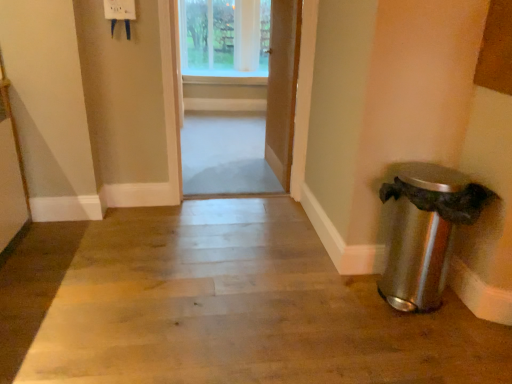
Describe the element at coordinates (244, 118) in the screenshot. Image resolution: width=512 pixels, height=384 pixels. I see `wooden door at center, the first door when ordered from left to right` at that location.

Identify the location of clear glass window at upper center. Image resolution: width=512 pixels, height=384 pixels. (224, 37).

Based on the photo, which is nearer, (403, 247) or (103, 220)?

The point (403, 247) is more forward.

In the image, is satin silver trash can at lower right positioned in front of or behind wooden floor at center?

Clearly, satin silver trash can at lower right is behind wooden floor at center.

Can you confirm if satin silver trash can at lower right is positioned to the left of wooden floor at center?

No, satin silver trash can at lower right is not to the left of wooden floor at center.

Considering the sizes of objects satin silver trash can at lower right and wooden floor at center in the image provided, who is taller, satin silver trash can at lower right or wooden floor at center?

Standing taller between the two is satin silver trash can at lower right.

Identify the location of window above the wooden door at center, the first door when ordered from left to right (from the image's perspective). (224, 37).

Between point (199, 164) and point (218, 9), which one is positioned in front?

The point (199, 164) is in front.

From a real-world perspective, is wooden door at center, which ranks as the 2th door in right-to-left order, above or below clear glass window at upper center?

From a real-world perspective, wooden door at center, which ranks as the 2th door in right-to-left order, is physically below clear glass window at upper center.

Is wooden door at center, which is the first door from right to left, inside the boundaries of wooden door at center, the first door when ordered from left to right, or outside?

wooden door at center, which is the first door from right to left, is not inside wooden door at center, the first door when ordered from left to right, it's outside.

From a real-world perspective, is wooden door at center, which is the first door from right to left, located beneath wooden door at center, the first door when ordered from left to right?

No, from a real-world perspective, wooden door at center, which is the first door from right to left, is not under wooden door at center, the first door when ordered from left to right.

Which of these two, wooden door at center, which is the first door from right to left, or wooden door at center, the first door when ordered from left to right, is bigger?

With larger size is wooden door at center, the first door when ordered from left to right.

Locate an element on the screen. Image resolution: width=512 pixels, height=384 pixels. waste container below the clear glass window at upper center (from the image's perspective) is located at coordinates (426, 231).

Does clear glass window at upper center turn towards satin silver trash can at lower right?

Yes.

How many degrees apart are the facing directions of clear glass window at upper center and satin silver trash can at lower right?

The angular difference between clear glass window at upper center and satin silver trash can at lower right is 4.98 degrees.

Does clear glass window at upper center appear on the left side of satin silver trash can at lower right?

Yes, clear glass window at upper center is to the left of satin silver trash can at lower right.

Can you tell me how much wooden door at center, which is the first door from right to left, and wooden floor at center differ in facing direction?

wooden door at center, which is the first door from right to left, and wooden floor at center are facing 94.8 degrees away from each other.

Considering the sizes of wooden door at center, the 2th door viewed from the left, and wooden floor at center in the image, is wooden door at center, the 2th door viewed from the left, wider or thinner than wooden floor at center?

wooden door at center, the 2th door viewed from the left, is thinner than wooden floor at center.

At what (x,y) coordinates should I click in order to perform the action: click on the 2nd door behind the wooden floor at center. Please return your answer as a coordinate pair (x, y). The width and height of the screenshot is (512, 384). Looking at the image, I should click on coord(282,86).

In the scene shown: From the image's perspective, which is below, wooden door at center, the 2th door viewed from the left, or wooden floor at center?

From the image's view, wooden floor at center is below.

Considering the sizes of clear glass window at upper center and wooden floor at center in the image, is clear glass window at upper center wider or thinner than wooden floor at center?

In the image, clear glass window at upper center appears to be more narrow than wooden floor at center.

Can you confirm if clear glass window at upper center is bigger than wooden floor at center?

No.

Who is taller, clear glass window at upper center or wooden floor at center?

Standing taller between the two is clear glass window at upper center.

Is wooden floor at center facing away from satin silver trash can at lower right?

No, wooden floor at center is not facing away from satin silver trash can at lower right.

In the image, is wooden floor at center positioned in front of or behind satin silver trash can at lower right?

wooden floor at center is in front of satin silver trash can at lower right.

Can you confirm if wooden floor at center is thinner than satin silver trash can at lower right?

No.

The width and height of the screenshot is (512, 384). What are the coordinates of `path below the satin silver trash can at lower right (from a real-world perspective)` in the screenshot? It's located at (220, 306).

Where is `the 1st door to the right when counting from the clear glass window at upper center`? The image size is (512, 384). the 1st door to the right when counting from the clear glass window at upper center is located at coordinates (244, 118).

Which object lies nearer to the anchor point satin silver trash can at lower right, clear glass window at upper center or wooden door at center, the first door when ordered from left to right?

wooden door at center, the first door when ordered from left to right, is closer to satin silver trash can at lower right.

From the image, which object appears to be nearer to wooden door at center, the 2th door viewed from the left, wooden door at center, which ranks as the 2th door in right-to-left order, or clear glass window at upper center?

wooden door at center, which ranks as the 2th door in right-to-left order.

Looking at the image, which one is located further to wooden door at center, the 2th door viewed from the left, wooden floor at center or clear glass window at upper center?

clear glass window at upper center.

Considering their positions, is clear glass window at upper center positioned closer to wooden door at center, the 2th door viewed from the left, than wooden floor at center?

The object closer to wooden door at center, the 2th door viewed from the left, is wooden floor at center.

When comparing their distances from wooden floor at center, does clear glass window at upper center or wooden door at center, the 2th door viewed from the left, seem further?

Among the two, clear glass window at upper center is located further to wooden floor at center.

When comparing their distances from wooden door at center, the first door when ordered from left to right, does wooden floor at center or wooden door at center, which is the first door from right to left, seem closer?

Based on the image, wooden door at center, which is the first door from right to left, appears to be nearer to wooden door at center, the first door when ordered from left to right.

From the image, which object appears to be farther from wooden door at center, which is the first door from right to left, wooden floor at center or wooden door at center, the first door when ordered from left to right?

wooden floor at center.

When comparing their distances from wooden door at center, the first door when ordered from left to right, does wooden floor at center or clear glass window at upper center seem further?

wooden floor at center lies further to wooden door at center, the first door when ordered from left to right, than the other object.

Identify the location of waste container between wooden floor at center and wooden door at center, which ranks as the 2th door in right-to-left order, along the z-axis. The image size is (512, 384). (426, 231).

Identify the location of door between satin silver trash can at lower right and wooden door at center, the 2th door viewed from the left, along the z-axis. (244, 118).

Identify the location of door located between wooden door at center, the first door when ordered from left to right, and clear glass window at upper center in the depth direction. This screenshot has width=512, height=384. (282, 86).

Locate an element on the screen. This screenshot has height=384, width=512. waste container between wooden floor at center and wooden door at center, the 2th door viewed from the left, in the front-back direction is located at coordinates (426, 231).